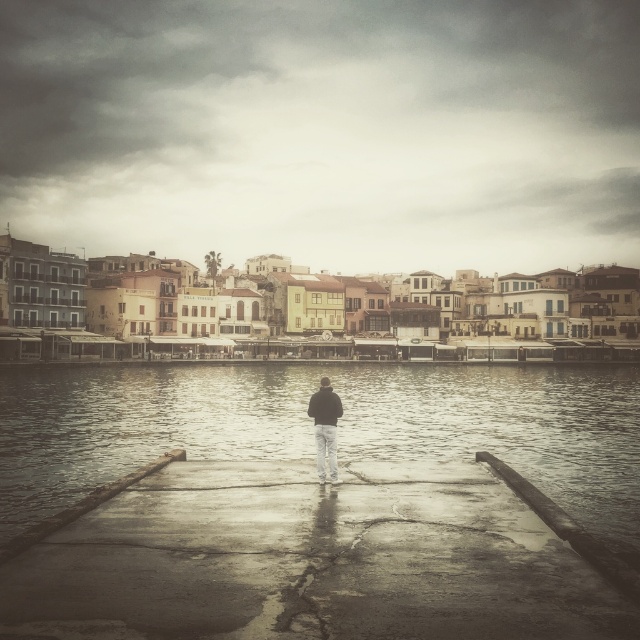
You are standing on the cracked concrete surface at the waterfront. There is a point marked at coordinates (308, 561) on the concrete dock. What is located at that point?

The point at coordinates (308, 561) marks the concrete wet dock at center.

You are a photographer trying to capture the dark blue jacket at center and the concrete wet dock at center in the same frame. Which object will appear larger in your photo?

The dark blue jacket at center will appear larger in the photo because it is taller than the concrete wet dock at center.

You are a photographer wanting to capture the reflection of the dark blue jacket at center in the water. Based on the scene, can you determine if the concrete wet dock at center is positioned in a way that allows the jacket to be reflected in the water?

The concrete wet dock at center is below the dark blue jacket at center, so the jacket is positioned above the dock. Since reflections require a reflective surface like water to be below the object, the jacket would need to be above the water for its reflection to appear. However, the dock is between the jacket and the water, so the reflection might not be visible unless the water is directly under the jacket.